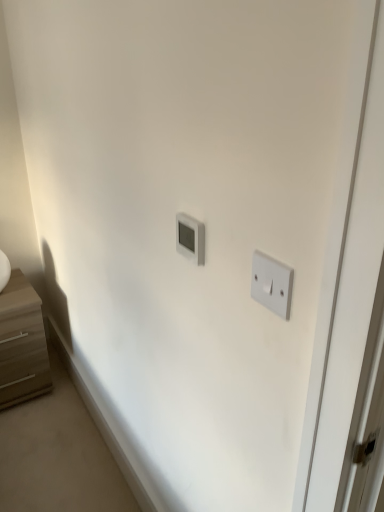
Question: Is white plastic light switch at right, the first light switch when ordered from right to left, turned away from white plastic thermostat at center, the 2th light switch viewed from the front?

Choices:
 (A) yes
 (B) no

Answer: (B)

Question: From a real-world perspective, is white plastic light switch at right, which appears as the 2th light switch when viewed from the left, located higher than white plastic thermostat at center, arranged as the 2th light switch when viewed from the right?

Choices:
 (A) no
 (B) yes

Answer: (B)

Question: Is white plastic light switch at right, which appears as the 2th light switch when viewed from the left, aimed at white plastic thermostat at center, which is the first light switch from back to front?

Choices:
 (A) no
 (B) yes

Answer: (A)

Question: Is white plastic thermostat at center, arranged as the 2th light switch when viewed from the right, completely or partially inside white plastic light switch at right, the first light switch when ordered from right to left?

Choices:
 (A) no
 (B) yes

Answer: (A)

Question: Is white plastic light switch at right, the first light switch when ordered from right to left, next to white plastic thermostat at center, which is the first light switch from back to front?

Choices:
 (A) yes
 (B) no

Answer: (B)

Question: Is white plastic light switch at right, marked as the second light switch in a back-to-front arrangement, positioned in front of white plastic thermostat at center, which is the first light switch from back to front?

Choices:
 (A) yes
 (B) no

Answer: (A)

Question: From a real-world perspective, is white plastic thermostat at center, the 2th light switch viewed from the front, below white plastic light switch at right, which appears as the 2th light switch when viewed from the left?

Choices:
 (A) yes
 (B) no

Answer: (A)

Question: Is white plastic thermostat at center, which is the first light switch from back to front, positioned before white plastic light switch at right, the first light switch when ordered from right to left?

Choices:
 (A) yes
 (B) no

Answer: (B)

Question: Is white plastic thermostat at center, arranged as the 2th light switch when viewed from the right, not inside white plastic light switch at right, which appears as the 2th light switch when viewed from the left?

Choices:
 (A) yes
 (B) no

Answer: (A)

Question: Could you tell me if white plastic thermostat at center, which is the first light switch from back to front, is turned towards white plastic light switch at right, placed as the 1th light switch when sorted from front to back?

Choices:
 (A) yes
 (B) no

Answer: (B)

Question: Considering the relative positions of white plastic thermostat at center, which is the first light switch from back to front, and white plastic light switch at right, which appears as the 2th light switch when viewed from the left, in the image provided, is white plastic thermostat at center, which is the first light switch from back to front, to the right of white plastic light switch at right, which appears as the 2th light switch when viewed from the left, from the viewer's perspective?

Choices:
 (A) no
 (B) yes

Answer: (A)

Question: Does white plastic thermostat at center, which is the first light switch from back to front, have a greater height compared to white plastic light switch at right, placed as the 1th light switch when sorted from front to back?

Choices:
 (A) yes
 (B) no

Answer: (B)

Question: Is white plastic thermostat at center, arranged as the 2th light switch when viewed from the right, located within light brown wood chest of drawers at left?

Choices:
 (A) no
 (B) yes

Answer: (A)